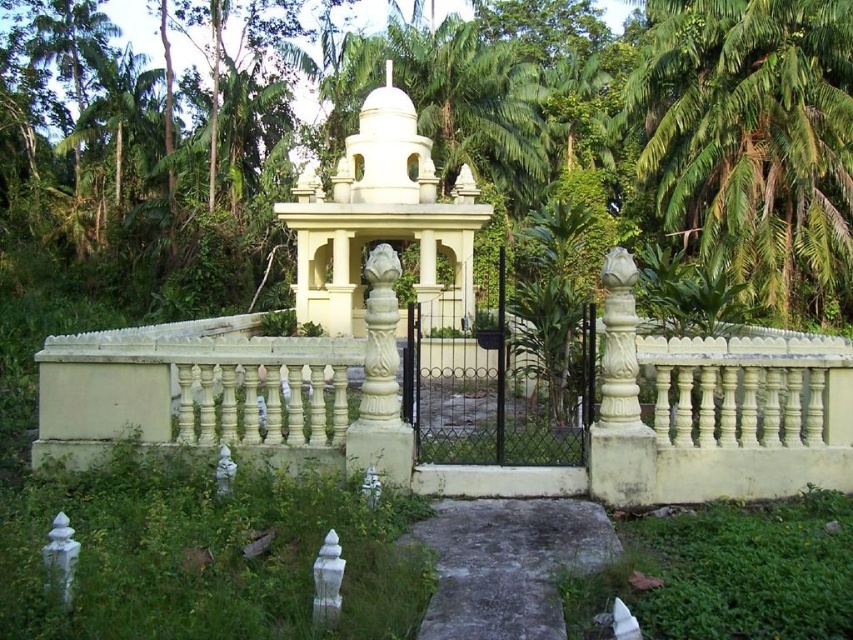
Question: Is green leafy palm tree at upper right positioned before white stone gazebo at center?

Choices:
 (A) no
 (B) yes

Answer: (A)

Question: Is green leafy palm tree at upper right thinner than white stone gazebo at center?

Choices:
 (A) yes
 (B) no

Answer: (B)

Question: Which object is positioned closest to the white stone gazebo at center?

Choices:
 (A) white stone fence at center
 (B) green leafy palm tree at upper right

Answer: (A)

Question: Which of the following is the closest to the observer?

Choices:
 (A) (428, 227)
 (B) (721, 268)

Answer: (A)

Question: Among these objects, which one is farthest from the camera?

Choices:
 (A) green leafy palm tree at upper right
 (B) white stone fence at center
 (C) white stone gazebo at center

Answer: (A)

Question: Can you confirm if white stone fence at center is bigger than green leafy palm tree at upper right?

Choices:
 (A) no
 (B) yes

Answer: (A)